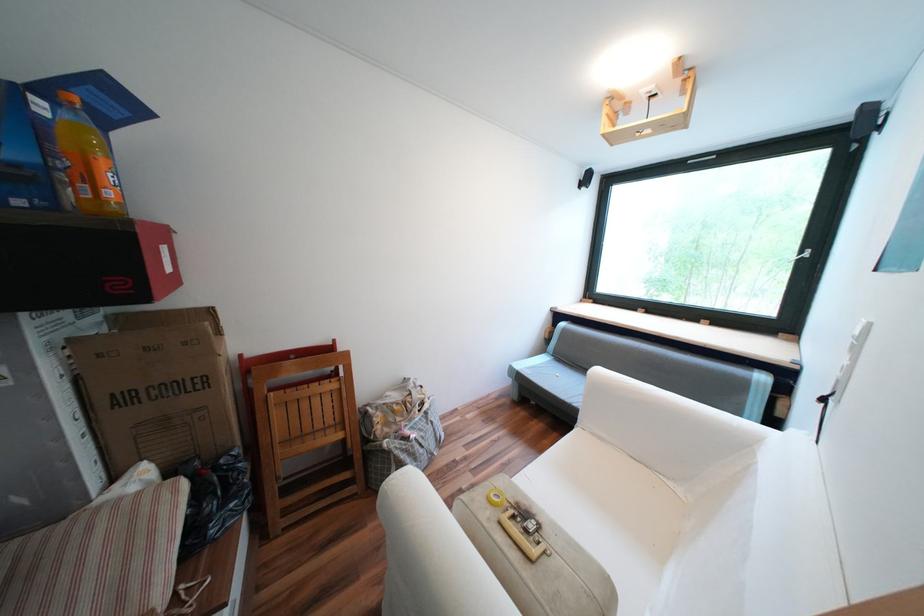
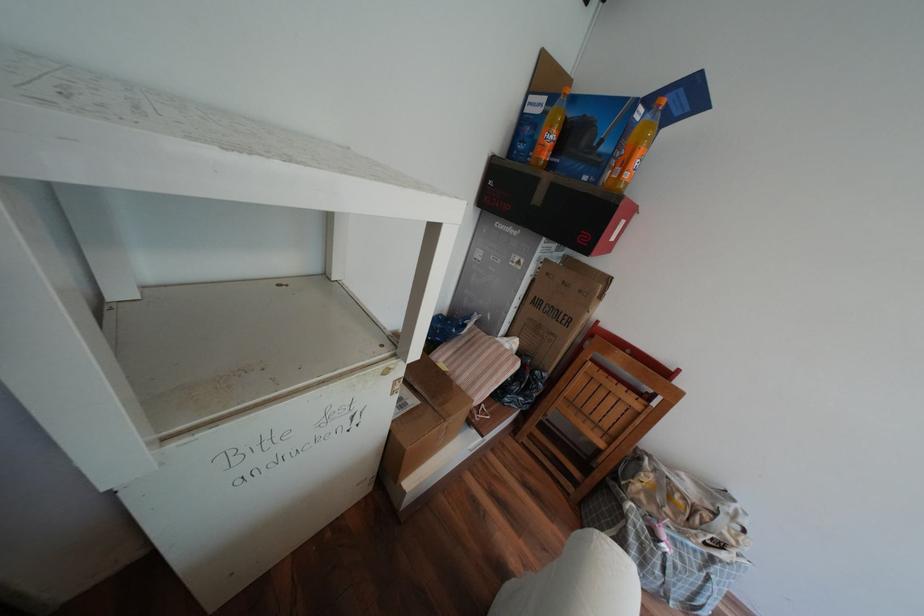
Where in the second image is the point corresponding to (x=165, y=500) from the first image?

(517, 360)